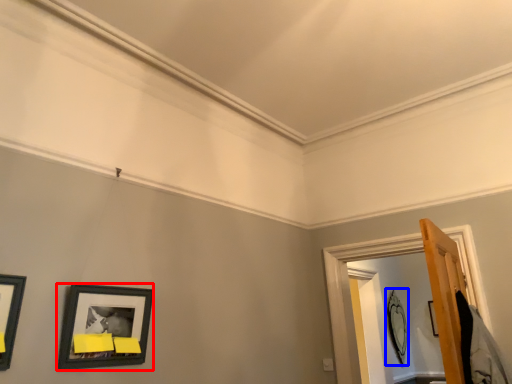
Question: Among these objects, which one is farthest to the camera, picture frame (highlighted by a red box) or picture frame (highlighted by a blue box)?

Choices:
 (A) picture frame
 (B) picture frame

Answer: (B)